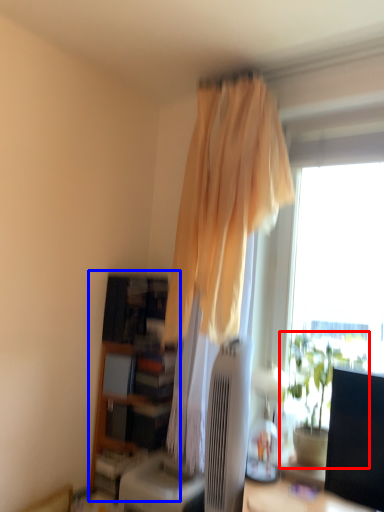
Question: Which of the following is the farthest to the observer, houseplant (highlighted by a red box) or bookshelf (highlighted by a blue box)?

Choices:
 (A) houseplant
 (B) bookshelf

Answer: (B)